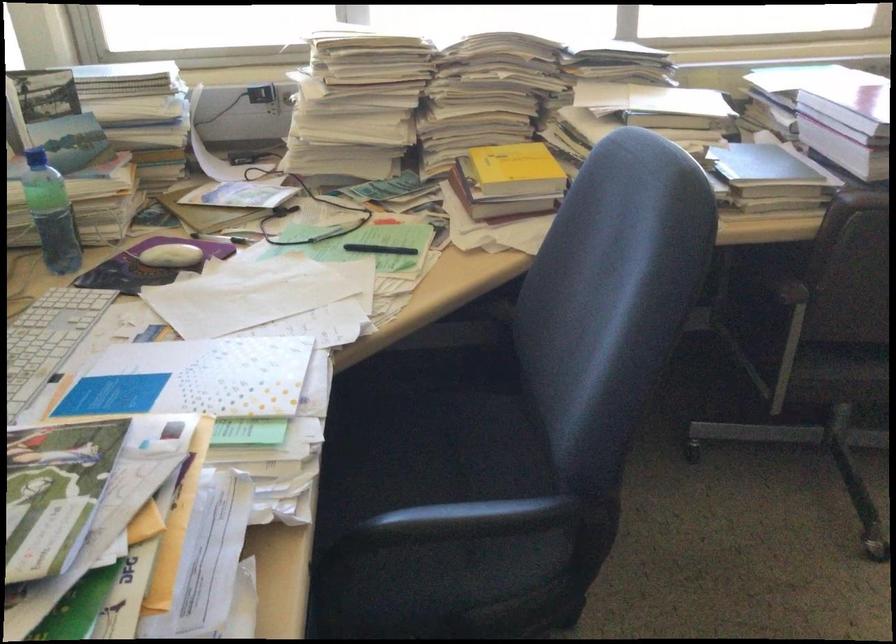
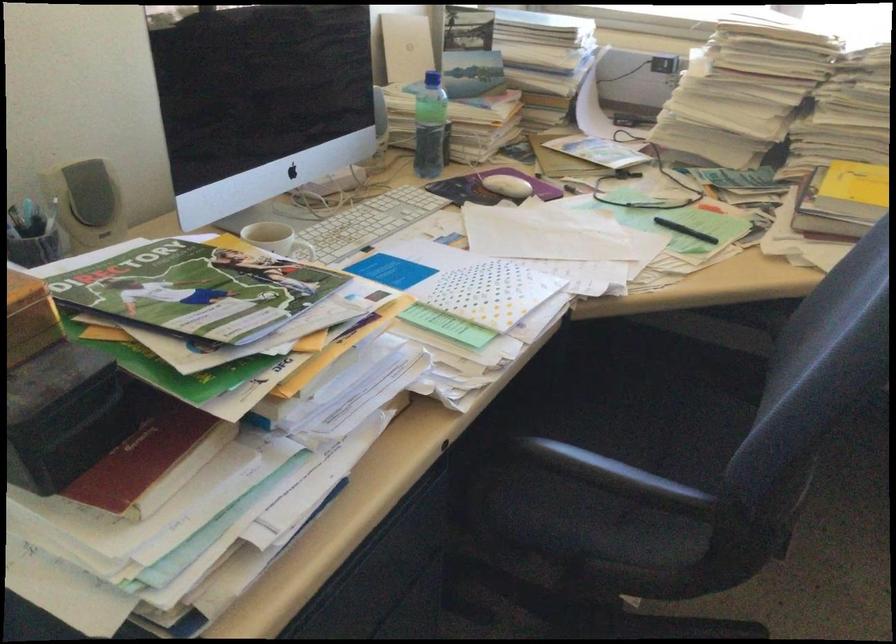
Find the pixel in the second image that matches [426,436] in the first image.

(653, 411)